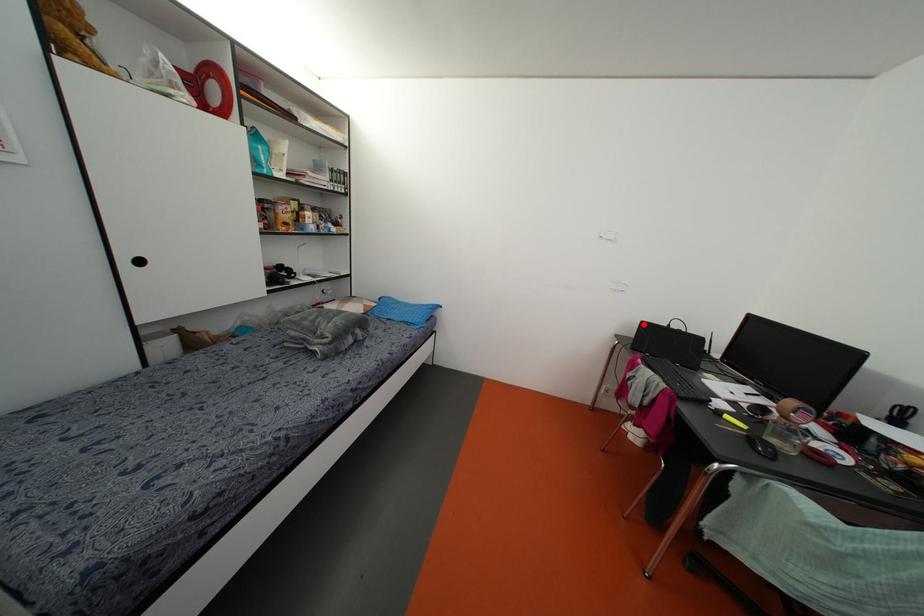
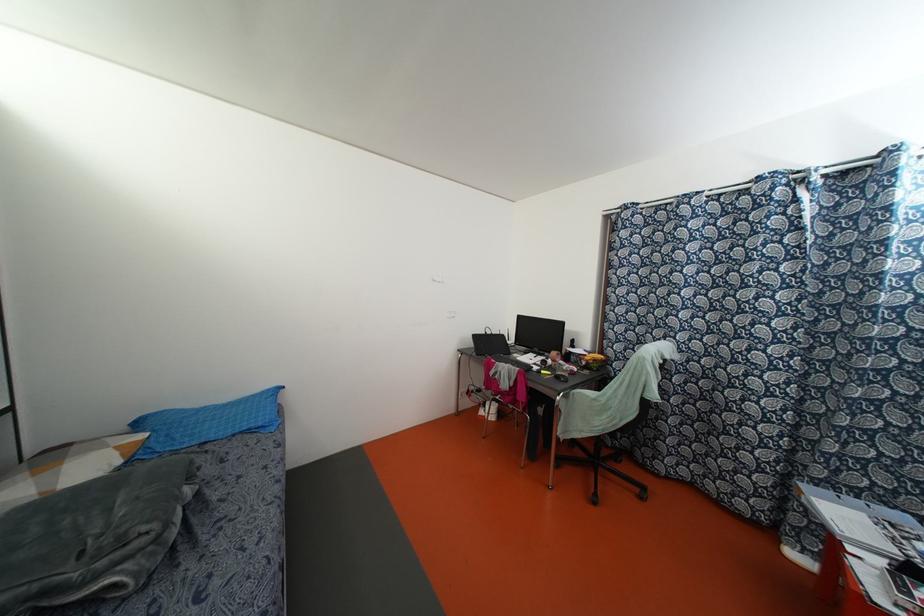
Where in the second image is the point corresponding to the highlighted location from the first image?

(473, 336)